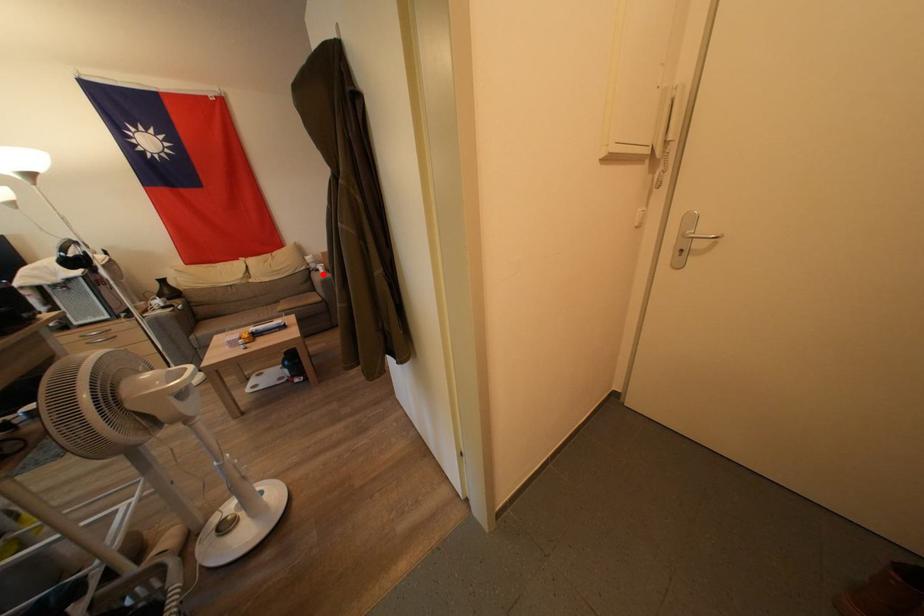
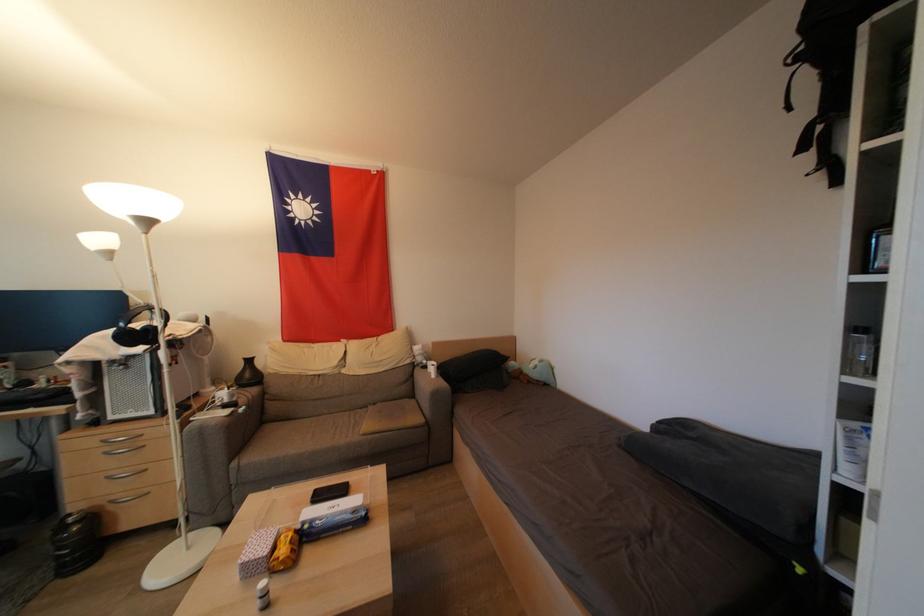
Question: I am providing you with two images of the same scene from different viewpoints. Given a red point in image1, look at the same physical point in image2. Is it:

Choices:
 (A) Closer to the viewpoint
 (B) Farther from the viewpoint

Answer: (A)